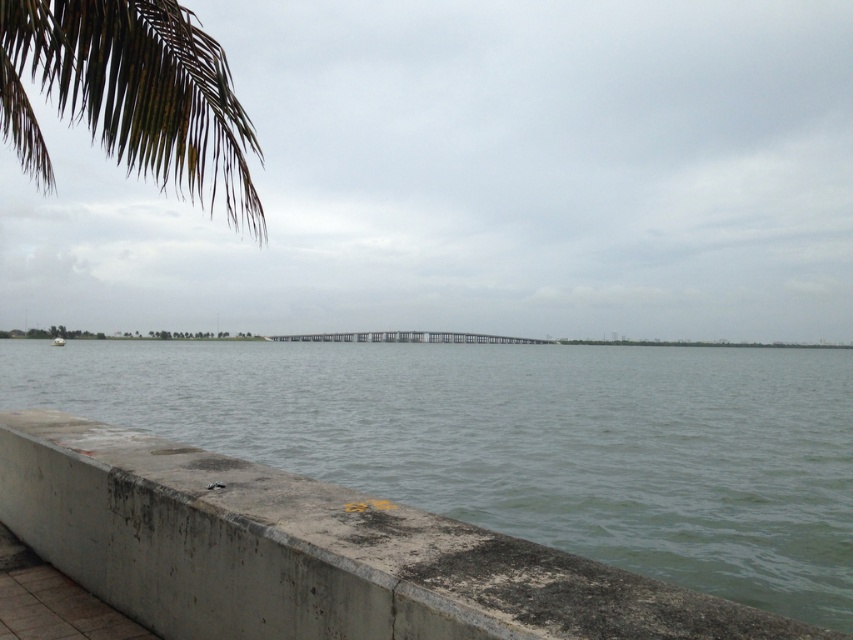
Question: Is gray concrete water at center below dark green leafy palm tree at upper left?

Choices:
 (A) yes
 (B) no

Answer: (A)

Question: Does gray concrete water at center appear under dark green leafy palm tree at upper left?

Choices:
 (A) no
 (B) yes

Answer: (B)

Question: Estimate the real-world distances between objects in this image. Which object is farther from the gray metallic rail at center?

Choices:
 (A) dark green leafy palm tree at upper left
 (B) gray concrete water at center

Answer: (B)

Question: Among these objects, which one is farthest from the camera?

Choices:
 (A) gray concrete water at center
 (B) dark green leafy palm tree at upper left

Answer: (A)

Question: Which object appears closest to the camera in this image?

Choices:
 (A) gray concrete water at center
 (B) dark green leafy palm tree at upper left
 (C) gray metallic rail at center

Answer: (B)

Question: Is gray concrete water at center bigger than dark green leafy palm tree at upper left?

Choices:
 (A) no
 (B) yes

Answer: (A)